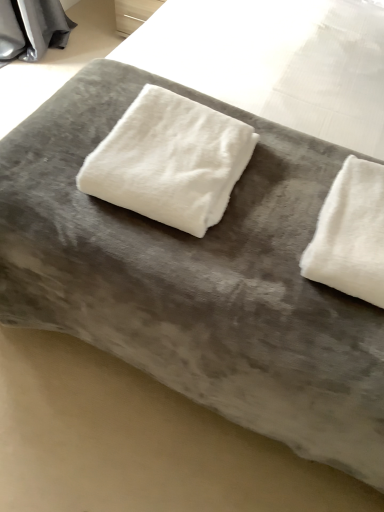
The image size is (384, 512). Identify the location of free point behind white fluffy towel at right, the second towel from the left. (306, 161).